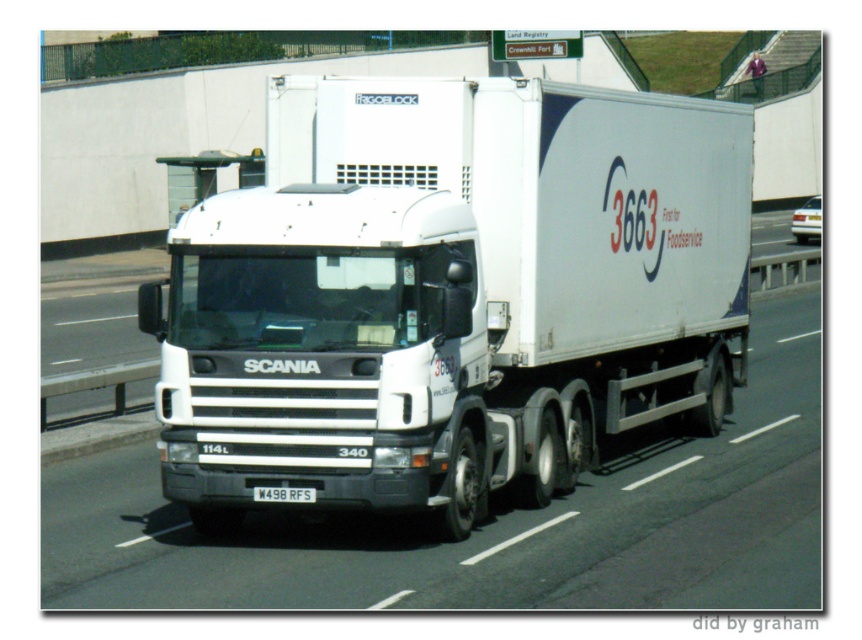
Measure the distance between white matte truck at center and camera.

white matte truck at center and camera are 33.85 feet apart.

Who is positioned more to the right, white matte truck at center or metallic silver taxi at right?

metallic silver taxi at right is more to the right.

Image resolution: width=862 pixels, height=640 pixels. What are the coordinates of `white matte truck at center` in the screenshot? It's located at (451, 294).

The image size is (862, 640). In order to click on white matte truck at center in this screenshot , I will do `click(451, 294)`.

Is white matte truck at center to the right of white plastic license plate at center from the viewer's perspective?

Incorrect, white matte truck at center is not on the right side of white plastic license plate at center.

Is point (361, 182) positioned in front of point (282, 497)?

No, it is behind (282, 497).

This screenshot has height=640, width=862. What do you see at coordinates (451, 294) in the screenshot?
I see `white matte truck at center` at bounding box center [451, 294].

Find the location of `white matte truck at center`. white matte truck at center is located at coordinates (451, 294).

Consider the image. Can you confirm if metallic silver taxi at right is bigger than white plastic license plate at center?

Correct, metallic silver taxi at right is larger in size than white plastic license plate at center.

Is metallic silver taxi at right positioned in front of white plastic license plate at center?

That is False.

Identify the location of metallic silver taxi at right. (807, 220).